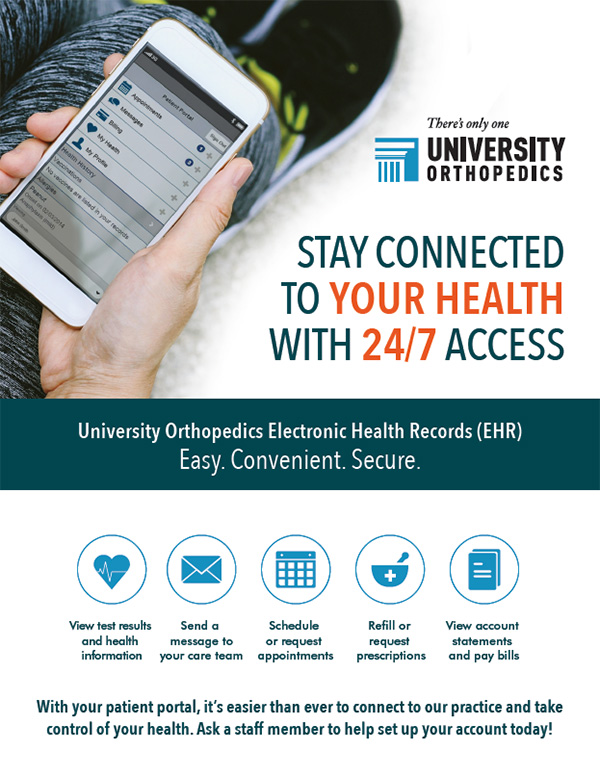
You are a GUI agent. You are given a task and a screenshot of the screen. Output one action in this format:
    pyautogui.click(x=<x>, y=<y>)
    Task: Click on the bowl
    The image size is (600, 778).
    Given the screenshot: What is the action you would take?
    pyautogui.click(x=383, y=573)